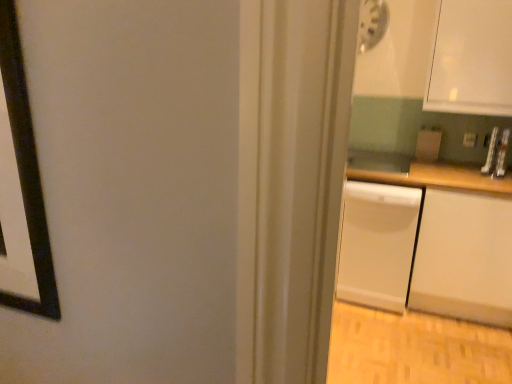
Question: From their relative heights in the image, would you say white matte counter at right is taller or shorter than matte white dishwasher at right?

Choices:
 (A) tall
 (B) short

Answer: (A)

Question: From a real-world perspective, is white matte counter at right positioned above or below matte white dishwasher at right?

Choices:
 (A) above
 (B) below

Answer: (B)

Question: Estimate the real-world distances between objects in this image. Which object is farther from the white matte dishwasher at right?

Choices:
 (A) matte white dishwasher at right
 (B) white matte counter at right

Answer: (A)

Question: Which of these objects is positioned farthest from the white matte dishwasher at right?

Choices:
 (A) white matte counter at right
 (B) matte white dishwasher at right

Answer: (B)